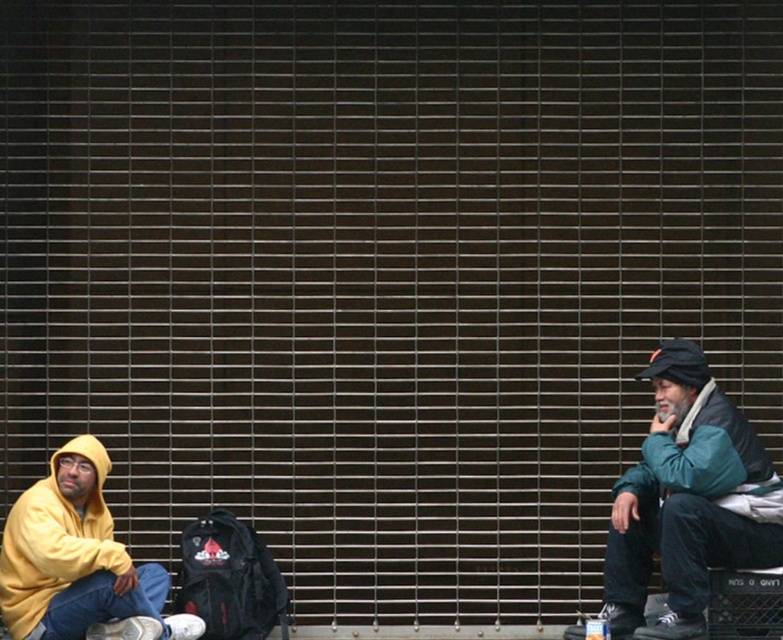
Does teal fleece jacket at right appear on the right side of matte yellow hoodie at lower left?

Indeed, teal fleece jacket at right is positioned on the right side of matte yellow hoodie at lower left.

Is point (682, 582) farther from camera compared to point (105, 600)?

No, (682, 582) is closer to viewer.

Is point (693, 474) farther from camera compared to point (24, 600)?

No, it is in front of (24, 600).

The height and width of the screenshot is (640, 783). Identify the location of teal fleece jacket at right. (687, 500).